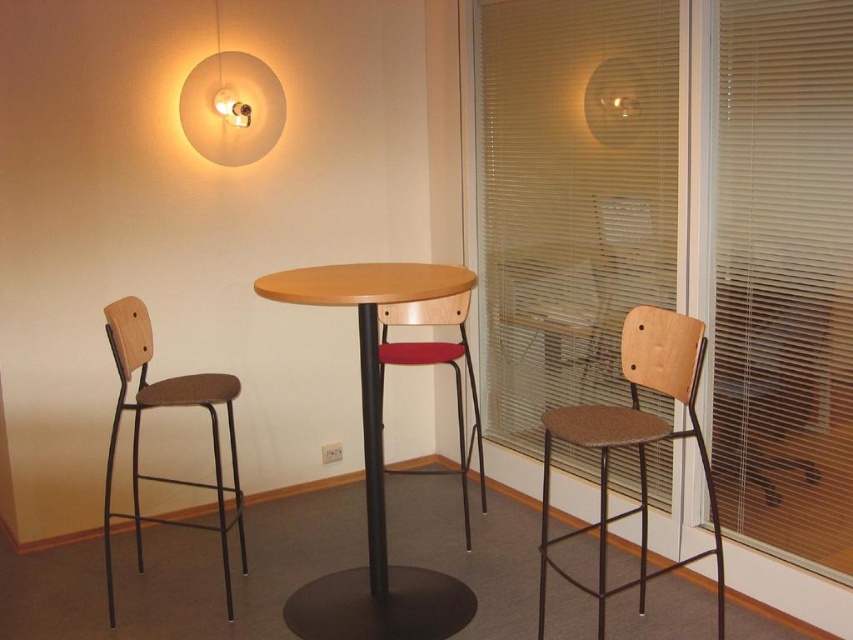
Question: Is translucent plastic blinds at right thinner than wooden bar stool at right?

Choices:
 (A) yes
 (B) no

Answer: (A)

Question: Which object appears farthest from the camera in this image?

Choices:
 (A) brown matte stool at left
 (B) translucent plastic blinds at right
 (C) transparent plastic blinds at right

Answer: (B)

Question: Which object is the closest to the wooden seat at center?

Choices:
 (A) transparent plastic blinds at right
 (B) brown matte stool at left
 (C) translucent plastic blinds at right
 (D) wooden bar stool at right

Answer: (C)

Question: Which object appears farthest from the camera in this image?

Choices:
 (A) wooden seat at center
 (B) wooden/matte table at center
 (C) brown matte stool at left

Answer: (A)

Question: Is translucent plastic blinds at right thinner than brown matte stool at left?

Choices:
 (A) no
 (B) yes

Answer: (B)

Question: Is translucent plastic blinds at right further to camera compared to brown matte stool at left?

Choices:
 (A) yes
 (B) no

Answer: (A)